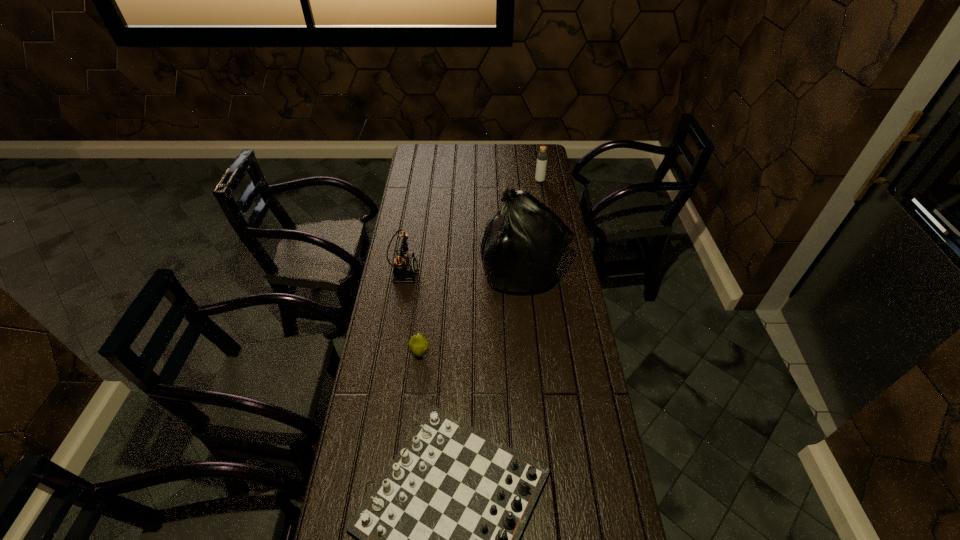
Locate an element on the screen. The image size is (960, 540). plastic bag is located at coordinates (523, 241).

At what (x,y) coordinates should I click in order to perform the action: click on bottle. Please return your answer as a coordinate pair (x, y). Looking at the image, I should click on pyautogui.click(x=542, y=157).

Where is `the third tallest object`? The image size is (960, 540). the third tallest object is located at coordinates pos(405,267).

This screenshot has height=540, width=960. What are the coordinates of `the fourth farthest object` in the screenshot? It's located at (418, 345).

At what (x,y) coordinates should I click in order to perform the action: click on free space located 0.190m on the left of the tallest object. Please return your answer as a coordinate pair (x, y). Image resolution: width=960 pixels, height=540 pixels. Looking at the image, I should click on (435, 269).

Where is `vacant space situated 0.050m on the back of the bottle`? This screenshot has height=540, width=960. vacant space situated 0.050m on the back of the bottle is located at coordinates (539, 172).

Locate an element on the screen. vacant space located on the front of the telephone at the rotary dial is located at coordinates (464, 271).

Identify the location of free space located on the back of the pear. This screenshot has width=960, height=540. (429, 273).

Locate an element on the screen. This screenshot has height=540, width=960. telephone present at the left edge is located at coordinates (405, 267).

The image size is (960, 540). Identify the location of pear situated at the left edge. (418, 345).